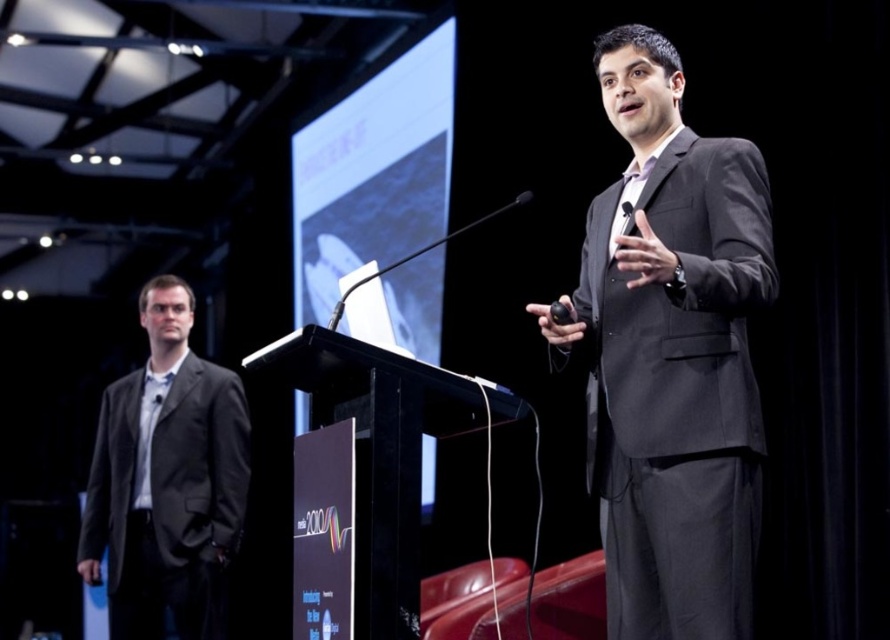
Between dark gray corduroy suit at left and black matte podium at center, which one has less height?

With less height is black matte podium at center.

This screenshot has height=640, width=890. Describe the element at coordinates (167, 481) in the screenshot. I see `dark gray corduroy suit at left` at that location.

Locate an element on the screen. dark gray corduroy suit at left is located at coordinates (167, 481).

Does dark gray corduroy suit at left have a greater width compared to black plastic microphone at center?

Yes, dark gray corduroy suit at left is wider than black plastic microphone at center.

Is dark gray corduroy suit at left smaller than black plastic microphone at center?

No.

Is point (164, 292) farther from camera compared to point (620, 205)?

Yes, point (164, 292) is behind point (620, 205).

Find the location of a particular element. The width and height of the screenshot is (890, 640). dark gray corduroy suit at left is located at coordinates (167, 481).

Which of these two, matte black suit at center or dark gray corduroy suit at left, stands taller?

dark gray corduroy suit at left

Is matte black suit at center to the right of dark gray corduroy suit at left from the viewer's perspective?

Indeed, matte black suit at center is positioned on the right side of dark gray corduroy suit at left.

Who is more distant from viewer, (700,506) or (142,605)?

Point (142,605)

Where is `matte black suit at center`? The image size is (890, 640). matte black suit at center is located at coordinates (670, 355).